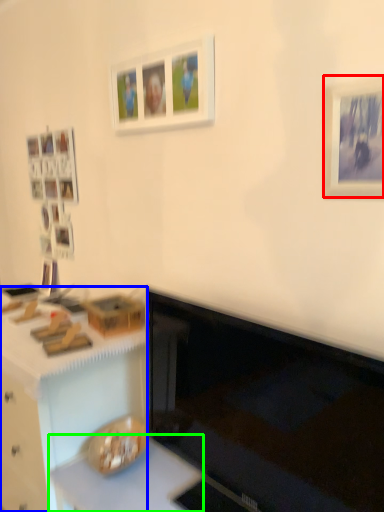
Question: Based on their relative distances, which object is nearer to picture frame (highlighted by a red box)? Choose from desk (highlighted by a blue box) and counter top (highlighted by a green box).

Choices:
 (A) desk
 (B) counter top

Answer: (B)